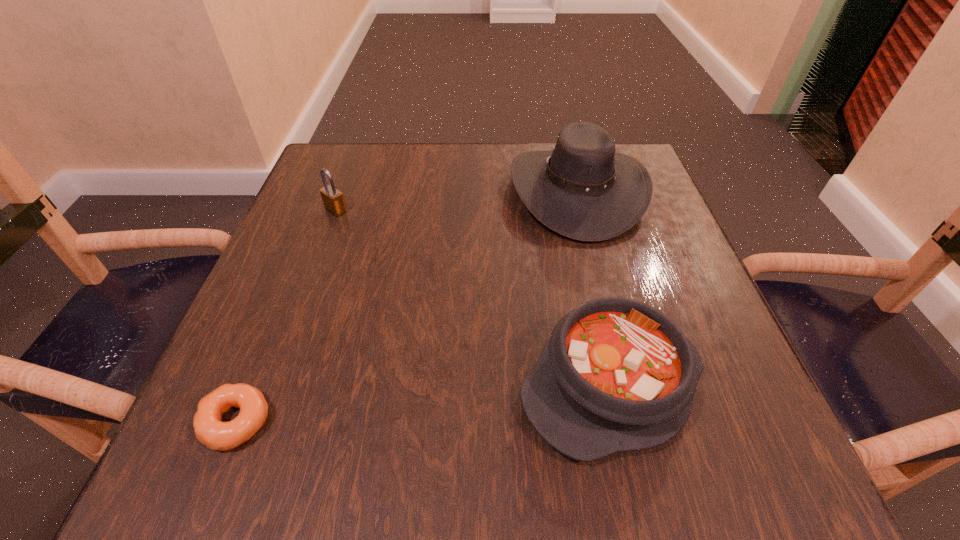
In order to click on blank region between the doughnut and the padlock in this screenshot , I will do `click(286, 316)`.

Locate an element on the screen. Image resolution: width=960 pixels, height=540 pixels. vacant point located between the cowboy hat and the doughnut is located at coordinates (407, 307).

This screenshot has width=960, height=540. I want to click on free space between the padlock and the doughnut, so click(x=286, y=316).

The width and height of the screenshot is (960, 540). Identify the location of vacant area that lies between the doughnut and the casserole. (423, 403).

You are a GUI agent. You are given a task and a screenshot of the screen. Output one action in this format:
    pyautogui.click(x=<x>, y=<y>)
    Task: Click on the vacant region between the doughnut and the cowboy hat
    The image size is (960, 540).
    Given the screenshot: What is the action you would take?
    pyautogui.click(x=407, y=307)

Image resolution: width=960 pixels, height=540 pixels. Find the location of `vacant area that lies between the shortest object and the tallest object`. vacant area that lies between the shortest object and the tallest object is located at coordinates (407, 307).

Locate which object ranks third in proximity to the cowboy hat. Please provide its 2D coordinates. Your answer should be formatted as a tuple, i.e. [(x, y)], where the tuple contains the x and y coordinates of a point satisfying the conditions above.

[(209, 429)]

Identify which object is located as the nearest to the doughnut. Please provide its 2D coordinates. Your answer should be formatted as a tuple, i.e. [(x, y)], where the tuple contains the x and y coordinates of a point satisfying the conditions above.

[(616, 375)]

What are the coordinates of `free location that satisfies the following two spatial constraints: 1. on the back side of the doughnut; 2. on the right side of the casserole` in the screenshot? It's located at (252, 384).

Where is `vacant region that satisfies the following two spatial constraints: 1. on the front-facing side of the cowboy hat; 2. on the front side of the casserole`? Image resolution: width=960 pixels, height=540 pixels. vacant region that satisfies the following two spatial constraints: 1. on the front-facing side of the cowboy hat; 2. on the front side of the casserole is located at coordinates (627, 384).